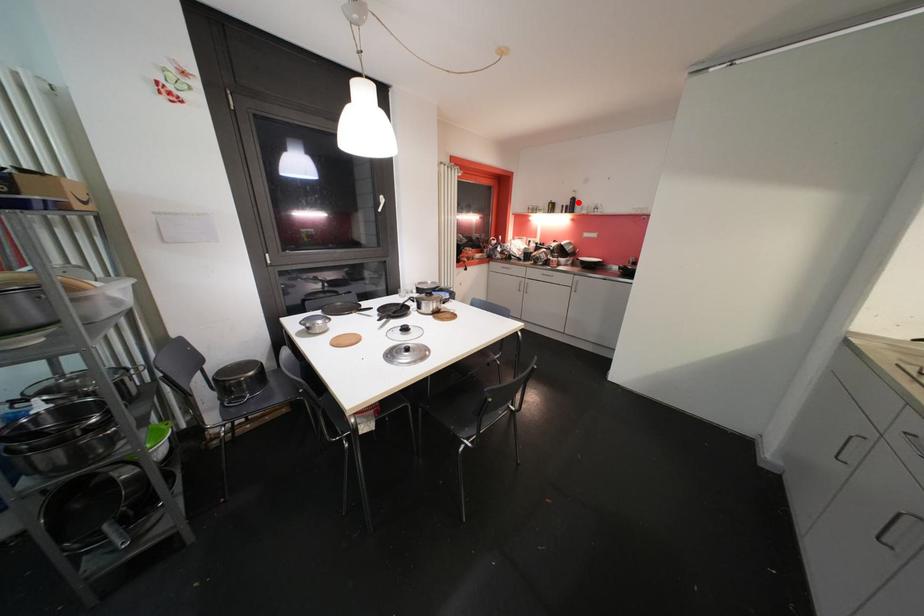
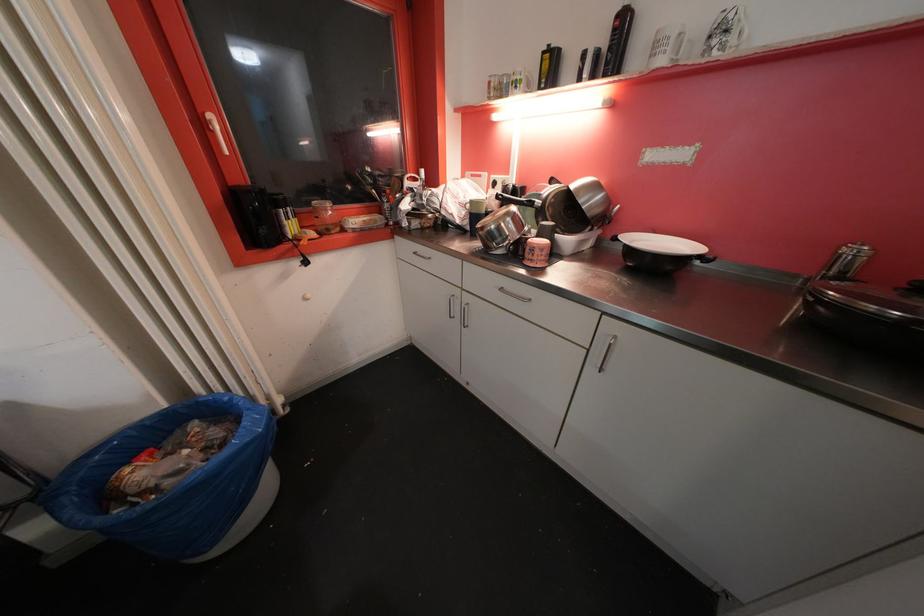
In the second image, find the point that corresponds to the highlighted location in the first image.

(628, 25)